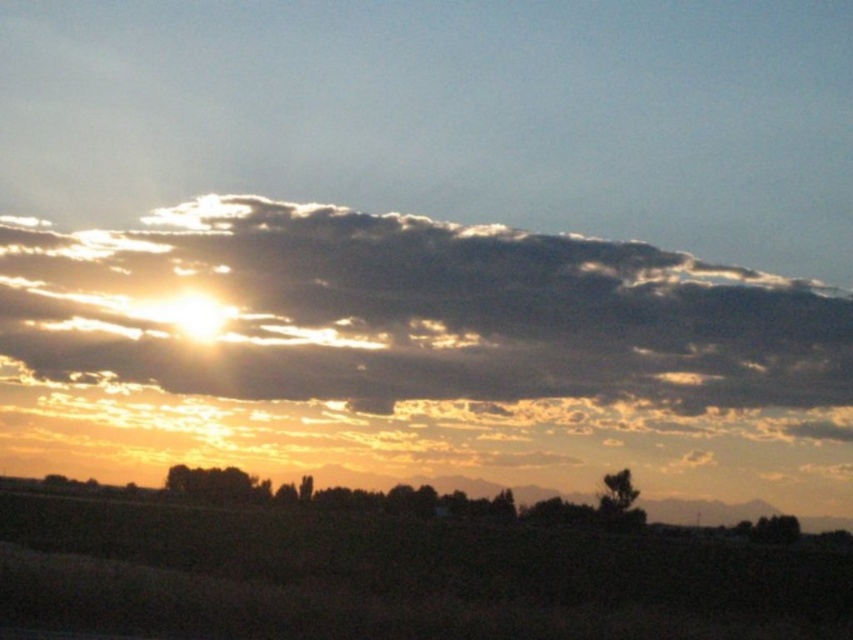
You are an astronomer observing the sunset and want to locate the sandy brown cloud at upper center. What are its coordinates in the image?

The sandy brown cloud at upper center is located at coordinates point (412, 314).

You are an artist trying to paint the sunset scene. You want to ensure the sandy brown cloud at upper center and the brown grassland at lower center are proportionally accurate. Which object should you make larger in your painting?

The sandy brown cloud at upper center should be made larger than the brown grassland at lower center because it is described as larger in size.